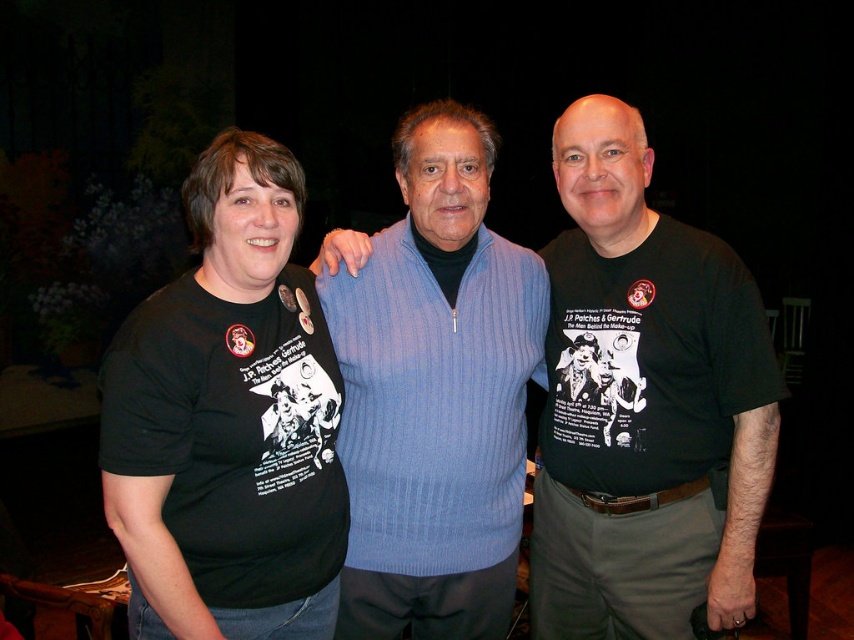
Question: Considering the real-world distances, which object is farthest from the light blue ribbed sweater at center?

Choices:
 (A) black cotton t-shirt at center
 (B) black cotton t-shirt at left
 (C) black t-shirt at center

Answer: (B)

Question: Does black cotton t-shirt at center have a greater width compared to black t-shirt at center?

Choices:
 (A) no
 (B) yes

Answer: (B)

Question: Does black t-shirt at center appear on the left side of light blue ribbed sweater at center?

Choices:
 (A) no
 (B) yes

Answer: (A)

Question: Which point is closer to the camera taking this photo?

Choices:
 (A) (752, 300)
 (B) (427, 538)
 (C) (583, 524)
 (D) (190, 419)

Answer: (D)

Question: Which point is closer to the camera?

Choices:
 (A) (626, 189)
 (B) (756, 346)
 (C) (349, 564)

Answer: (B)

Question: Can you confirm if black cotton t-shirt at center is positioned above black t-shirt at center?

Choices:
 (A) no
 (B) yes

Answer: (B)